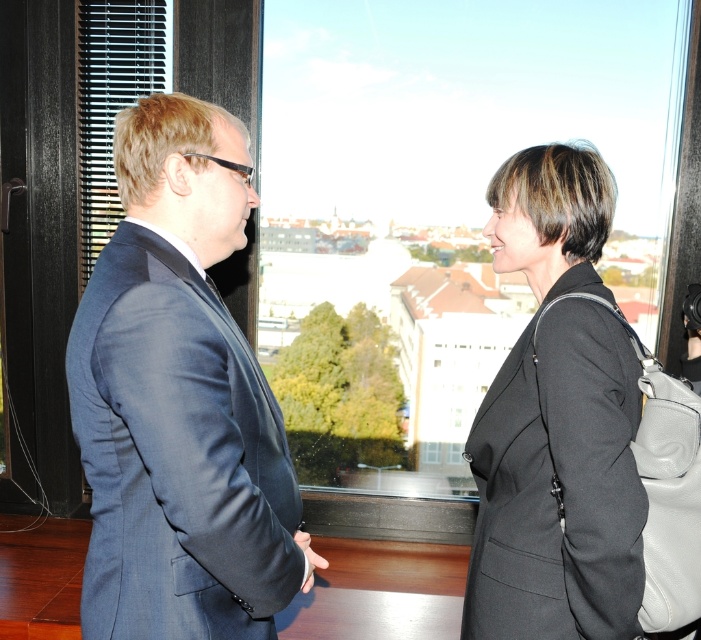
You are a photographer standing in front of the scene. You need to take a photo that includes both the dark blue suit at left and the matte black coat at right. Which object should you position closer to the left side of the frame to ensure both are visible?

The dark blue suit at left should be positioned closer to the left side of the frame since it is already on the left side of the matte black coat at right.

You are an event planner trying to arrange seating for a meeting. You see the dark blue suit at left and the matte black coat at right in the image. Which person should you seat closer to the front of the room if you want to prioritize the one who is more centrally positioned?

The dark blue suit at left should be seated closer to the front because it is positioned over the matte black coat at right, indicating it is more centrally located.

Where is the dark blue suit at left located in the image?

The dark blue suit at left is located at point (179, 400) in the image.